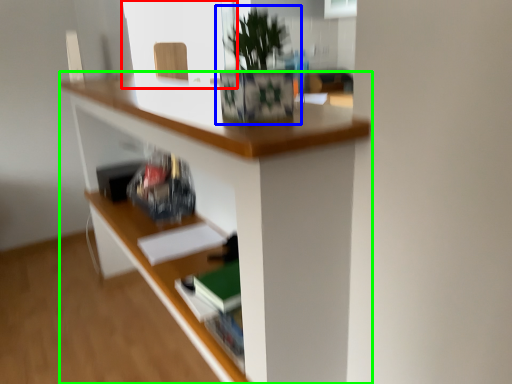
Question: Which object is the farthest from window screen (highlighted by a red box)? Choose among these: houseplant (highlighted by a blue box) or desk (highlighted by a green box).

Choices:
 (A) houseplant
 (B) desk

Answer: (A)